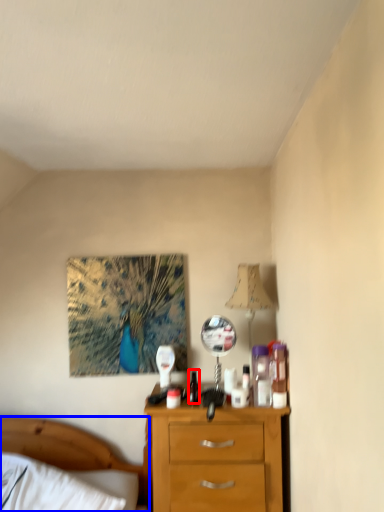
Question: Which of the following is the closest to the observer, bottle (highlighted by a red box) or bed (highlighted by a blue box)?

Choices:
 (A) bottle
 (B) bed

Answer: (B)